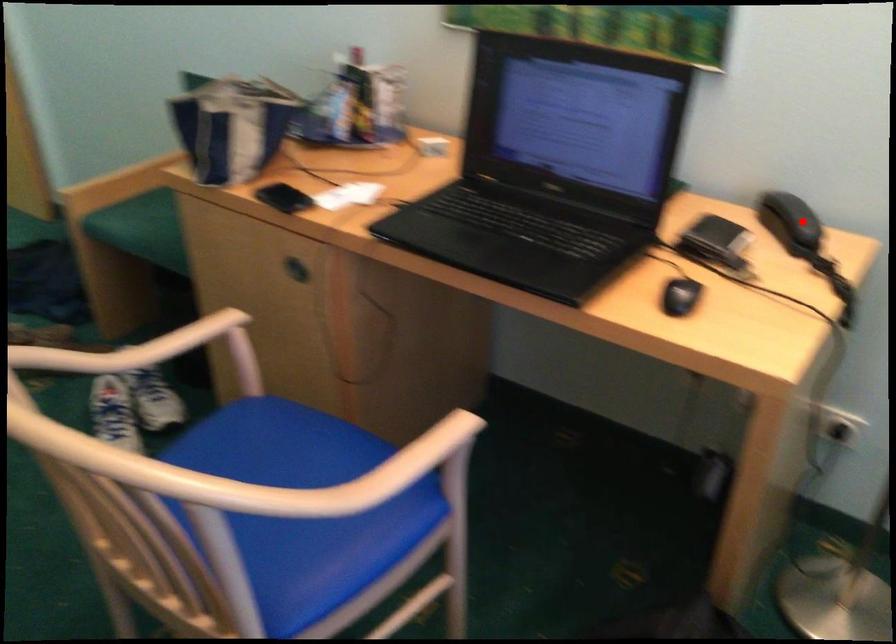
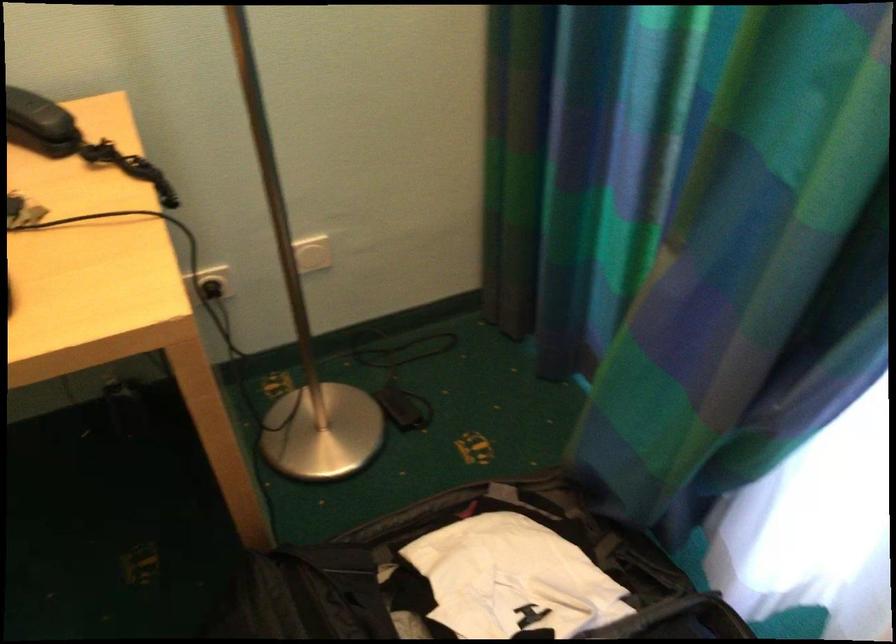
Question: I am providing you with two images of the same scene from different viewpoints. Given a red point in image1, look at the same physical point in image2. Is it:

Choices:
 (A) Closer to the viewpoint
 (B) Farther from the viewpoint

Answer: (A)